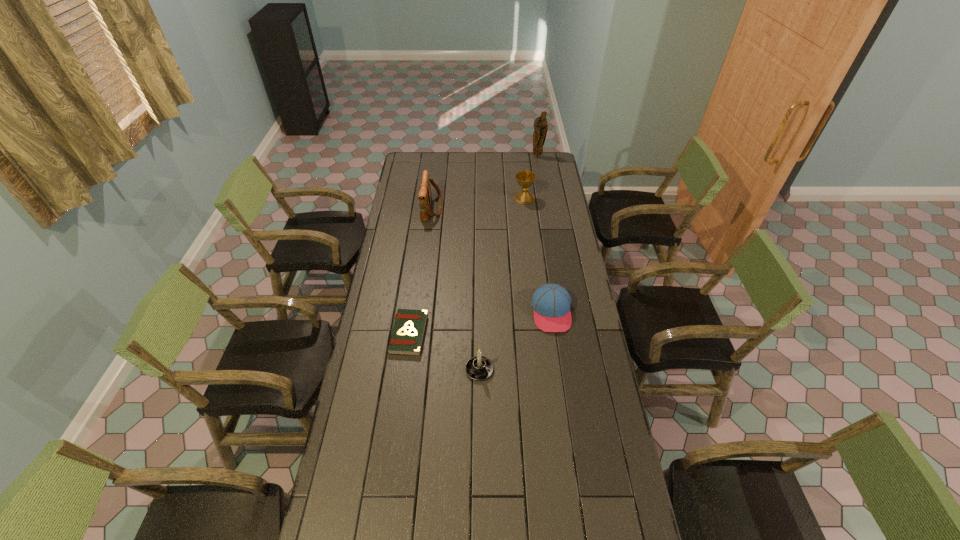
Where is `the farthest object`? The width and height of the screenshot is (960, 540). the farthest object is located at coordinates (540, 124).

Where is `figurine`? Image resolution: width=960 pixels, height=540 pixels. figurine is located at coordinates (540, 124).

Locate an element on the screen. The width and height of the screenshot is (960, 540). the fifth shortest object is located at coordinates (424, 196).

Where is `chalice`? The width and height of the screenshot is (960, 540). chalice is located at coordinates (525, 179).

I want to click on the nearest object, so click(x=478, y=368).

This screenshot has height=540, width=960. Identify the location of candle holder. (478, 368).

Locate an element on the screen. The image size is (960, 540). baseball cap is located at coordinates 551,302.

Where is `the shortest object`? Image resolution: width=960 pixels, height=540 pixels. the shortest object is located at coordinates (408, 331).

Identify the location of free space located 0.180m on the front-facing side of the tallest object. Image resolution: width=960 pixels, height=540 pixels. 540,174.

Find the location of a particular element. This screenshot has width=960, height=540. free space located 0.080m on the front-facing side of the shoulder bag is located at coordinates (457, 208).